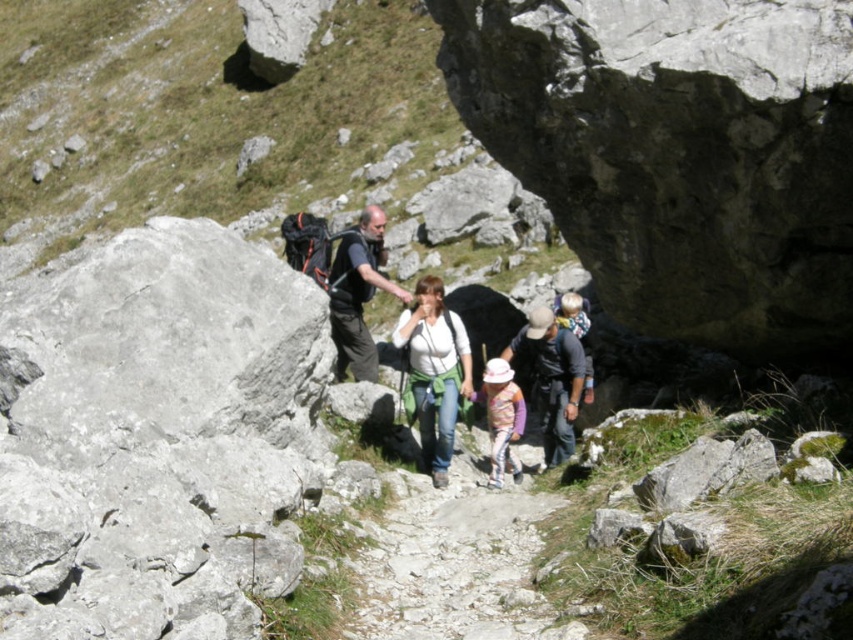
Question: In this image, where is dark gray fabric backpack at center located relative to purple fabric child at center?

Choices:
 (A) right
 (B) left

Answer: (B)

Question: Which object is the farthest from the purple fabric child at center?

Choices:
 (A) white fabric shirt at center
 (B) pastel pink fabric at center
 (C) matte black backpack at center
 (D) dark gray fabric backpack at center

Answer: (D)

Question: Is gray rocky trail at center above dark gray fabric backpack at center?

Choices:
 (A) no
 (B) yes

Answer: (A)

Question: Considering the real-world distances, which object is closest to the purple fabric child at center?

Choices:
 (A) dark gray fabric backpack at center
 (B) gray rocky trail at center
 (C) matte black backpack at center
 (D) pastel pink fabric at center

Answer: (D)

Question: Does matte black backpack at center appear on the right side of dark gray fabric backpack at center?

Choices:
 (A) no
 (B) yes

Answer: (B)

Question: Estimate the real-world distances between objects in this image. Which object is farther from the gray rocky trail at center?

Choices:
 (A) purple fabric child at center
 (B) pastel pink fabric at center

Answer: (A)